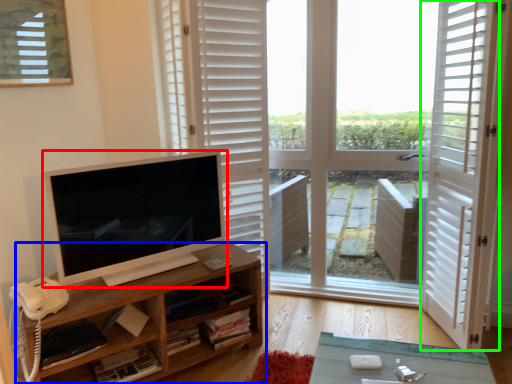
Question: Considering the real-world distances, which object is farthest from computer monitor (highlighted by a red box)? shelf (highlighted by a blue box) or screen door (highlighted by a green box)?

Choices:
 (A) shelf
 (B) screen door

Answer: (B)